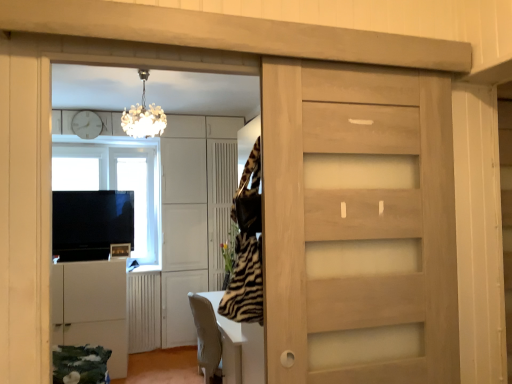
Based on the photo, measure the distance between point [124,250] and camera.

Point [124,250] is 4.04 meters from camera.

Image resolution: width=512 pixels, height=384 pixels. I want to click on white wooden clock at upper center, so (x=86, y=124).

I want to click on flat screen tv at left, the second appliance positioned from the bottom, so click(91, 223).

This screenshot has width=512, height=384. What are the coordinates of `matte white cabinet at left` in the screenshot? It's located at (140, 230).

What do you see at coordinates (116, 181) in the screenshot? I see `transparent glass window at upper left` at bounding box center [116, 181].

What are the coordinates of `metallic silver toaster at lower left, marked as the 2th appliance in a top-to-bottom arrangement` in the screenshot? It's located at (120, 250).

From the image's perspective, is white matte cabinet at lower left below matte white cabinet at left?

Yes, from the image's perspective, white matte cabinet at lower left is below matte white cabinet at left.

Considering the relative positions of white matte cabinet at lower left and matte white cabinet at left in the image provided, is white matte cabinet at lower left to the right of matte white cabinet at left from the viewer's perspective?

No.

From a real-world perspective, who is located higher, white matte cabinet at lower left or matte white cabinet at left?

matte white cabinet at left.

Is matte white cabinet at left at the left side of white wooden clock at upper center?

Incorrect, matte white cabinet at left is not on the left side of white wooden clock at upper center.

Who is shorter, matte white cabinet at left or white wooden clock at upper center?

A: white wooden clock at upper center is shorter.

Does matte white cabinet at left have a larger size compared to white wooden clock at upper center?

Correct, matte white cabinet at left is larger in size than white wooden clock at upper center.

Does point (145, 178) come closer to viewer compared to point (90, 125)?

No, (145, 178) is further to viewer.

From the image's perspective, is transparent glass window at upper left above or below matte white cabinet at left?

From the image's perspective, transparent glass window at upper left appears below matte white cabinet at left.

Is transparent glass window at upper left wider or thinner than matte white cabinet at left?

Clearly, transparent glass window at upper left has less width compared to matte white cabinet at left.

Is transparent glass window at upper left turned away from matte white cabinet at left?

No, transparent glass window at upper left is not facing away from matte white cabinet at left.

Who is shorter, transparent glass window at upper left or matte white cabinet at left?

Standing shorter between the two is matte white cabinet at left.

From a real-world perspective, is white wooden clock at upper center beneath flat screen tv at left, the second appliance positioned from the bottom?

Incorrect, from a real-world perspective, white wooden clock at upper center is higher than flat screen tv at left, the second appliance positioned from the bottom.

Which of these two, white wooden clock at upper center or flat screen tv at left, which is counted as the 1th appliance, starting from the top, is thinner?

With smaller width is white wooden clock at upper center.

Which is more to the left, white wooden clock at upper center or flat screen tv at left, which is counted as the 1th appliance, starting from the top?

white wooden clock at upper center.

Is white wooden clock at upper center surrounding flat screen tv at left, the second appliance positioned from the bottom?

Actually, flat screen tv at left, the second appliance positioned from the bottom, is outside white wooden clock at upper center.

From a real-world perspective, is white wooden clock at upper center positioned over matte white cabinet at left based on gravity?

Indeed, from a real-world perspective, white wooden clock at upper center stands above matte white cabinet at left.

From the image's perspective, is white wooden clock at upper center above matte white cabinet at left?

Yes.

How different are the orientations of white wooden clock at upper center and matte white cabinet at left in degrees?

white wooden clock at upper center and matte white cabinet at left are facing 178 degrees away from each other.

Looking at this image, does white glossy table at center lie in front of white matte cabinet at lower left?

Yes, it is.

Is white glossy table at center far from white matte cabinet at lower left?

Yes, white glossy table at center and white matte cabinet at lower left are quite far apart.

Considering the positions of objects white glossy table at center and white matte cabinet at lower left in the image provided, who is more to the left, white glossy table at center or white matte cabinet at lower left?

Positioned to the left is white matte cabinet at lower left.

Who is bigger, white glossy table at center or white matte cabinet at lower left?

With larger size is white matte cabinet at lower left.

Are white wooden clock at upper center and white matte cabinet at lower left far apart?

That's right, there is a large distance between white wooden clock at upper center and white matte cabinet at lower left.

Between point (76, 129) and point (73, 303), which one is positioned in front?

The point (73, 303) is closer to the camera.

Is white wooden clock at upper center oriented towards white matte cabinet at lower left?

No, white wooden clock at upper center is not aimed at white matte cabinet at lower left.

Would you say white wooden clock at upper center is outside white matte cabinet at lower left?

Indeed, white wooden clock at upper center is completely outside white matte cabinet at lower left.

This screenshot has height=384, width=512. Find the location of `entertainment center on the right of white matte cabinet at lower left`. entertainment center on the right of white matte cabinet at lower left is located at coordinates (140, 230).

The width and height of the screenshot is (512, 384). What are the coordinates of `clock that is above the matte white cabinet at left (from a real-world perspective)` in the screenshot? It's located at (86, 124).

Considering their positions, is white wooden clock at upper center positioned closer to flat screen tv at left, the second appliance positioned from the bottom, than white glossy table at center?

white wooden clock at upper center lies closer to flat screen tv at left, the second appliance positioned from the bottom, than the other object.

When comparing their distances from metallic silver toaster at lower left, marked as the 2th appliance in a top-to-bottom arrangement, does white matte cabinet at lower left or white wooden clock at upper center seem closer?

white matte cabinet at lower left is closer to metallic silver toaster at lower left, marked as the 2th appliance in a top-to-bottom arrangement.

Which object lies nearer to the anchor point white glossy table at center, matte white cabinet at left or white matte cabinet at lower left?

white matte cabinet at lower left is closer to white glossy table at center.

Considering their positions, is matte white cabinet at left positioned closer to metallic silver toaster at lower left, marked as the 2th appliance in a top-to-bottom arrangement, than white matte cabinet at lower left?

The object closer to metallic silver toaster at lower left, marked as the 2th appliance in a top-to-bottom arrangement, is white matte cabinet at lower left.

From the image, which object appears to be farther from matte white cabinet at left, metallic silver toaster at lower left, marked as the first appliance in a bottom-to-top arrangement, or white matte cabinet at lower left?

The object further to matte white cabinet at left is metallic silver toaster at lower left, marked as the first appliance in a bottom-to-top arrangement.

Based on their spatial positions, is white matte cabinet at lower left or transparent glass window at upper left closer to white glossy table at center?

white matte cabinet at lower left lies closer to white glossy table at center than the other object.

Estimate the real-world distances between objects in this image. Which object is further from matte white cabinet at left, white wooden clock at upper center or white matte cabinet at lower left?

The object further to matte white cabinet at left is white wooden clock at upper center.

From the image, which object appears to be nearer to transparent glass window at upper left, white glossy table at center or matte white cabinet at left?

Based on the image, matte white cabinet at left appears to be nearer to transparent glass window at upper left.

At what (x,y) coordinates should I click in order to perform the action: click on cabinetry positioned between matte white cabinet at left and flat screen tv at left, which is counted as the 1th appliance, starting from the top, from near to far. Please return your answer as a coordinate pair (x, y). Looking at the image, I should click on (91, 308).

At what (x,y) coordinates should I click in order to perform the action: click on appliance located between flat screen tv at left, the second appliance positioned from the bottom, and transparent glass window at upper left in the depth direction. Please return your answer as a coordinate pair (x, y). Image resolution: width=512 pixels, height=384 pixels. Looking at the image, I should click on (120, 250).

Find the location of a particular element. clock between white glossy table at center and transparent glass window at upper left from front to back is located at coordinates pyautogui.click(x=86, y=124).

Locate an element on the screen. cabinetry between matte white cabinet at left and white wooden clock at upper center along the z-axis is located at coordinates (91, 308).